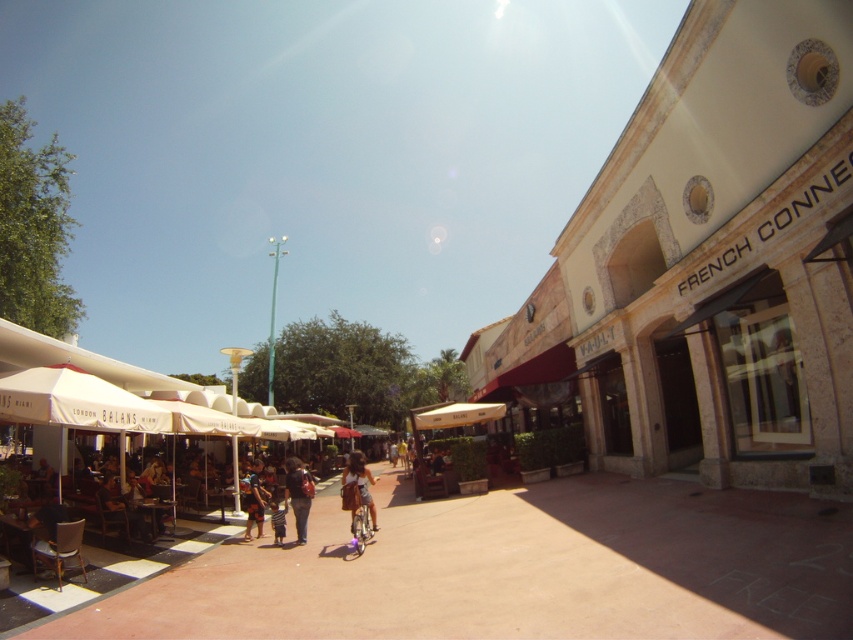
Consider the image. You are standing at the point labeled point [245,502] and want to walk to the point labeled point [352,480]. Which direction should you move to get closer to your destination?

You should move towards the camera because point [352,480] is closer to the camera than point [245,502].

You are a photographer standing in the plaza and want to take a photo of both the white fabric canopy at center and the blue denim shorts at center. Which object should you focus on first to ensure both are in sharp focus?

You should focus on the white fabric canopy at center first because it is closer to you than the blue denim shorts at center, ensuring both will be in focus when using a camera with a fixed focus distance.

You are a photographer carrying a matte black backpack at center and want to take a photo of a white fabric canopy at center. Since the canopy is larger, will it completely block the backpack from view if you stand directly in front of them?

The white fabric canopy at center is bigger than the matte black backpack at center, so if you stand directly in front of them, the canopy will likely block the backpack from view because it is larger in size.